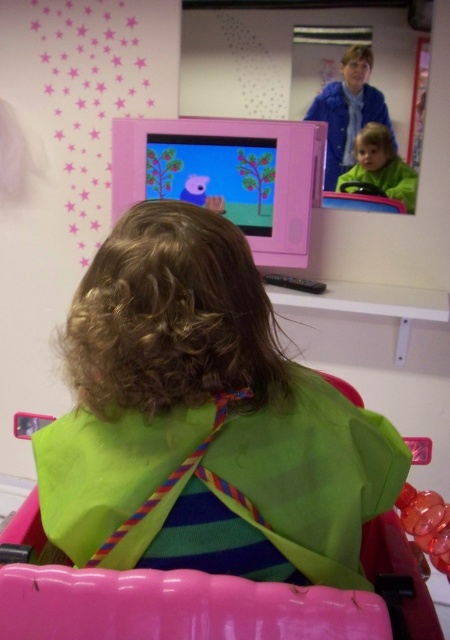
Question: Is green fabric at center above green matte jacket at center?

Choices:
 (A) no
 (B) yes

Answer: (A)

Question: Can you confirm if green fabric at center is smaller than green matte jacket at center?

Choices:
 (A) no
 (B) yes

Answer: (A)

Question: Does green fabric at center appear on the left side of green matte jacket at center?

Choices:
 (A) yes
 (B) no

Answer: (A)

Question: Among these points, which one is nearest to the camera?

Choices:
 (A) (180, 561)
 (B) (400, 177)

Answer: (A)

Question: Which point is closer to the camera taking this photo?

Choices:
 (A) click(x=230, y=492)
 (B) click(x=355, y=156)

Answer: (A)